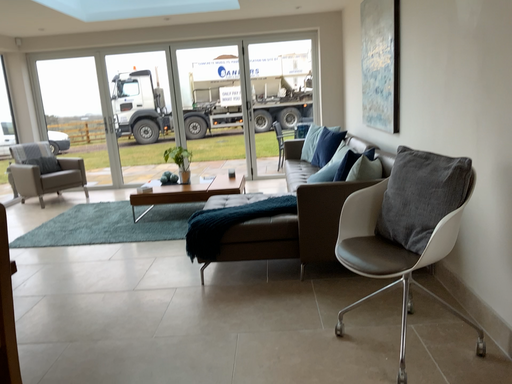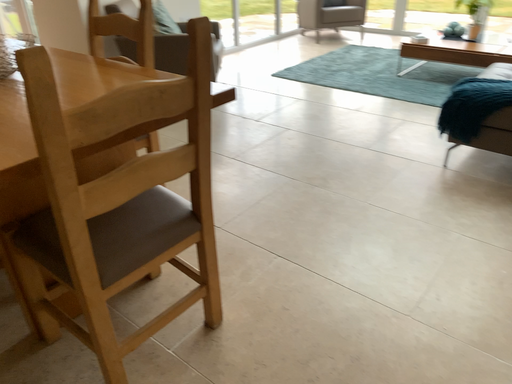
Question: Which way did the camera rotate in the video?

Choices:
 (A) rotated downward
 (B) rotated upward

Answer: (A)